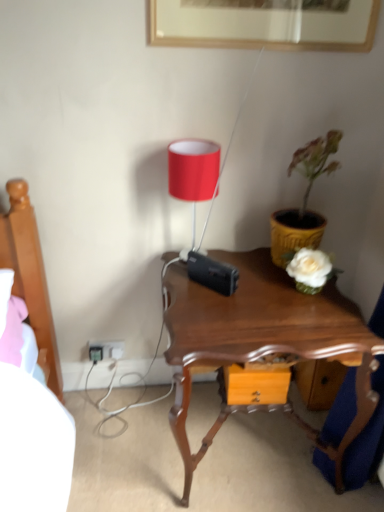
Describe the element at coordinates (303, 200) in the screenshot. I see `yellow textured pot at right` at that location.

You are a GUI agent. You are given a task and a screenshot of the screen. Output one action in this format:
    pyautogui.click(x=<x>, y=<y>)
    Task: Click on the mahogany wood nightstand at center
    
    Given the screenshot: What is the action you would take?
    pyautogui.click(x=261, y=341)

Describe the element at coordinates (105, 350) in the screenshot. I see `white plastic electric outlet at lower left` at that location.

What are the coordinates of `yellow textured pot at right` in the screenshot? It's located at (303, 200).

Does point (96, 358) appear closer or farther from the camera than point (275, 246)?

Point (96, 358) appears to be farther away from the viewer than point (275, 246).

The width and height of the screenshot is (384, 512). In order to click on plug located on the left of yellow textured pot at right in this screenshot , I will do `click(95, 353)`.

What's the angular difference between black plastic plug at lower left and yellow textured pot at right's facing directions?

The angular difference between black plastic plug at lower left and yellow textured pot at right is 0.00521 degrees.

Considering the sizes of black plastic plug at lower left and yellow textured pot at right in the image, is black plastic plug at lower left bigger or smaller than yellow textured pot at right?

black plastic plug at lower left is smaller than yellow textured pot at right.

Is yellow textured pot at right wider or thinner than mahogany wood nightstand at center?

yellow textured pot at right is thinner than mahogany wood nightstand at center.

Between point (303, 160) and point (337, 476), which one is positioned in front?

Point (303, 160)

You are a GUI agent. You are given a task and a screenshot of the screen. Output one action in this format:
    pyautogui.click(x=<x>, y=<y>)
    Task: Click on the nightstand below the yellow textured pot at right (from a real-world perspective)
    Image resolution: width=384 pixels, height=512 pixels.
    Given the screenshot: What is the action you would take?
    pyautogui.click(x=261, y=341)

Is the position of yellow textured pot at right more distant than that of mahogany wood nightstand at center?

Yes.

Which of these two, white plastic electric outlet at lower left or black plastic plug at lower left, is wider?

With larger width is black plastic plug at lower left.

Looking at this image, can you confirm if white plastic electric outlet at lower left is positioned to the left of black plastic plug at lower left?

Incorrect, white plastic electric outlet at lower left is not on the left side of black plastic plug at lower left.

Is white plastic electric outlet at lower left oriented towards black plastic plug at lower left?

Yes, white plastic electric outlet at lower left is turned towards black plastic plug at lower left.

In terms of size, does white plastic electric outlet at lower left appear bigger or smaller than black plastic plug at lower left?

Clearly, white plastic electric outlet at lower left is larger in size than black plastic plug at lower left.

Does point (96, 361) appear closer or farther from the camera than point (170, 306)?

Point (96, 361) appears to be farther away from the viewer than point (170, 306).

What's the angular difference between black plastic plug at lower left and mahogany wood nightstand at center's facing directions?

There is a 0.00652-degree angle between the facing directions of black plastic plug at lower left and mahogany wood nightstand at center.

Considering the positions of objects black plastic plug at lower left and mahogany wood nightstand at center in the image provided, who is more to the left, black plastic plug at lower left or mahogany wood nightstand at center?

black plastic plug at lower left is more to the left.

Is black plastic plug at lower left wider than mahogany wood nightstand at center?

No, black plastic plug at lower left is not wider than mahogany wood nightstand at center.

Considering the positions of objects yellow textured pot at right and white plastic electric outlet at lower left in the image provided, who is more to the left, yellow textured pot at right or white plastic electric outlet at lower left?

From the viewer's perspective, white plastic electric outlet at lower left appears more on the left side.

Find the location of a particular element. This screenshot has height=512, width=384. houseplant that appears above the white plastic electric outlet at lower left (from a real-world perspective) is located at coordinates (303, 200).

Considering the relative sizes of yellow textured pot at right and white plastic electric outlet at lower left in the image provided, is yellow textured pot at right bigger than white plastic electric outlet at lower left?

Yes, yellow textured pot at right is bigger than white plastic electric outlet at lower left.

How many degrees apart are the facing directions of yellow textured pot at right and black plastic plug at lower left?

The angular difference between yellow textured pot at right and black plastic plug at lower left is 0.00521 degrees.

Is yellow textured pot at right taller than black plastic plug at lower left?

Indeed, yellow textured pot at right has a greater height compared to black plastic plug at lower left.

Between point (311, 184) and point (99, 359), which one is positioned behind?

Point (99, 359)

Locate an element on the screen. This screenshot has height=512, width=384. plug located behind the yellow textured pot at right is located at coordinates (95, 353).

In terms of height, does mahogany wood nightstand at center look taller or shorter compared to yellow textured pot at right?

Considering their sizes, mahogany wood nightstand at center has more height than yellow textured pot at right.

Which object is thinner, mahogany wood nightstand at center or yellow textured pot at right?

yellow textured pot at right is thinner.

Does point (313, 310) appear closer or farther from the camera than point (328, 137)?

Point (313, 310) is positioned farther from the camera compared to point (328, 137).

In the scene shown: How many degrees apart are the facing directions of mahogany wood nightstand at center and yellow textured pot at right?

There is a 0.00138-degree angle between the facing directions of mahogany wood nightstand at center and yellow textured pot at right.

At what (x,y) coordinates should I click in order to perform the action: click on plug directly beneath the yellow textured pot at right (from a real-world perspective). Please return your answer as a coordinate pair (x, y). Looking at the image, I should click on (95, 353).

Image resolution: width=384 pixels, height=512 pixels. Find the location of `nightstand below the yellow textured pot at right (from the image's perspective)`. nightstand below the yellow textured pot at right (from the image's perspective) is located at coordinates (261, 341).

Considering their positions, is white plastic electric outlet at lower left positioned closer to mahogany wood nightstand at center than matte red lampshade at upper center?

matte red lampshade at upper center lies closer to mahogany wood nightstand at center than the other object.

Which object lies further to the anchor point white plastic electric outlet at lower left, mahogany wood nightstand at center or black plastic plug at lower left?

Based on the image, mahogany wood nightstand at center appears to be further to white plastic electric outlet at lower left.

Based on the photo, considering their positions, is mahogany wood nightstand at center positioned further to yellow textured pot at right than white plastic electric outlet at lower left?

white plastic electric outlet at lower left.

From the image, which object appears to be farther from black plastic plug at lower left, mahogany wood nightstand at center or white plastic electric outlet at lower left?

The object further to black plastic plug at lower left is mahogany wood nightstand at center.

When comparing their distances from matte red lampshade at upper center, does mahogany wood nightstand at center or black plastic plug at lower left seem closer?

mahogany wood nightstand at center is closer to matte red lampshade at upper center.

Looking at the image, which one is located further to mahogany wood nightstand at center, white plastic electric outlet at lower left or black plastic plug at lower left?

The object further to mahogany wood nightstand at center is black plastic plug at lower left.

Estimate the real-world distances between objects in this image. Which object is further from matte red lampshade at upper center, yellow textured pot at right or mahogany wood nightstand at center?

Among the two, mahogany wood nightstand at center is located further to matte red lampshade at upper center.

Which object lies nearer to the anchor point white plastic electric outlet at lower left, black plastic plug at lower left or yellow textured pot at right?

Based on the image, black plastic plug at lower left appears to be nearer to white plastic electric outlet at lower left.

At what (x,y) coordinates should I click in order to perform the action: click on table lamp located between black plastic plug at lower left and yellow textured pot at right in the left-right direction. Please return your answer as a coordinate pair (x, y). This screenshot has height=512, width=384. Looking at the image, I should click on (193, 172).

The height and width of the screenshot is (512, 384). I want to click on nightstand between white plastic electric outlet at lower left and yellow textured pot at right in the horizontal direction, so point(261,341).

Image resolution: width=384 pixels, height=512 pixels. I want to click on electric outlet between black plastic plug at lower left and yellow textured pot at right, so click(x=105, y=350).

Find the location of a particular element. This screenshot has height=512, width=384. electric outlet that lies between matte red lampshade at upper center and black plastic plug at lower left from top to bottom is located at coordinates (105, 350).